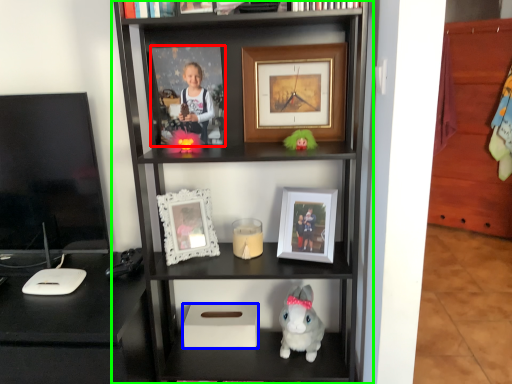
Question: Which object is positioned farthest from picture frame (highlighted by a red box)? Select from box (highlighted by a blue box) and shelf (highlighted by a green box).

Choices:
 (A) box
 (B) shelf

Answer: (A)